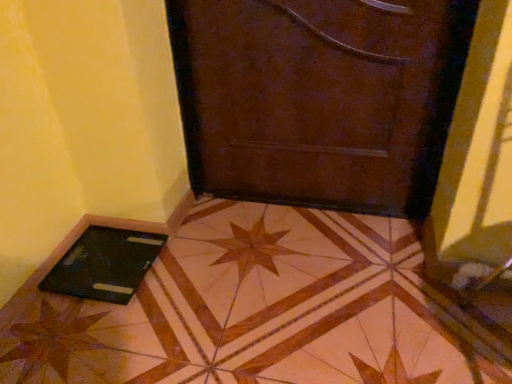
The width and height of the screenshot is (512, 384). What do you see at coordinates (261, 311) in the screenshot?
I see `black glossy laptop at lower left` at bounding box center [261, 311].

Locate an element on the screen. Image resolution: width=512 pixels, height=384 pixels. brown leather door at center is located at coordinates (317, 101).

Measure the distance between brown leather door at center and camera.

3.78 feet.

This screenshot has height=384, width=512. I want to click on black matte tablet at lower left, so click(x=104, y=264).

From the image's perspective, is brown leather door at center on black matte tablet at lower left?

Yes, from the image's perspective, brown leather door at center is above black matte tablet at lower left.

From a real-world perspective, is brown leather door at center above or below black matte tablet at lower left?

In terms of real-world spatial position, brown leather door at center is above black matte tablet at lower left.

Between brown leather door at center and black matte tablet at lower left, which one is positioned in front?

brown leather door at center.

Where is `door lying above the black matte tablet at lower left (from the image's perspective)`? The height and width of the screenshot is (384, 512). door lying above the black matte tablet at lower left (from the image's perspective) is located at coordinates (317, 101).

Can you tell me how much brown leather door at center and black glossy laptop at lower left differ in facing direction?

There is a 82.5-degree angle between the facing directions of brown leather door at center and black glossy laptop at lower left.

Locate an element on the screen. door above the black glossy laptop at lower left (from the image's perspective) is located at coordinates (317, 101).

Is brown leather door at center bigger or smaller than black glossy laptop at lower left?

In the image, brown leather door at center appears to be smaller than black glossy laptop at lower left.

From a real-world perspective, between black glossy laptop at lower left and black matte tablet at lower left, who is vertically higher?

black matte tablet at lower left is physically above.

Is black matte tablet at lower left surrounded by black glossy laptop at lower left?

Yes.

Between black glossy laptop at lower left and black matte tablet at lower left, which one has more height?

black glossy laptop at lower left is taller.

Is black glossy laptop at lower left to the left or to the right of black matte tablet at lower left in the image?

black glossy laptop at lower left is positioned on black matte tablet at lower left's right side.

Can you confirm if black glossy laptop at lower left is thinner than brown leather door at center?

In fact, black glossy laptop at lower left might be wider than brown leather door at center.

Does black glossy laptop at lower left lie in front of brown leather door at center?

Yes, the depth of black glossy laptop at lower left is less than that of brown leather door at center.

Is black glossy laptop at lower left turned away from brown leather door at center?

No, black glossy laptop at lower left is not facing away from brown leather door at center.

From a real-world perspective, is black glossy laptop at lower left beneath brown leather door at center?

Answer: Yes.

Would you consider black matte tablet at lower left to be distant from brown leather door at center?

That's not correct — black matte tablet at lower left is a little close to brown leather door at center.

Considering the positions of points (119, 277) and (354, 92), is point (119, 277) closer to camera compared to point (354, 92)?

No, (119, 277) is behind (354, 92).

Where is `door above the black matte tablet at lower left (from a real-world perspective)`? The height and width of the screenshot is (384, 512). door above the black matte tablet at lower left (from a real-world perspective) is located at coordinates (317, 101).

Is black matte tablet at lower left bigger or smaller than brown leather door at center?

Clearly, black matte tablet at lower left is smaller in size than brown leather door at center.

Where is `tablet computer above the black glossy laptop at lower left (from a real-world perspective)`? The height and width of the screenshot is (384, 512). tablet computer above the black glossy laptop at lower left (from a real-world perspective) is located at coordinates (104, 264).

Are black matte tablet at lower left and black glossy laptop at lower left making contact?

No, black matte tablet at lower left is not touching black glossy laptop at lower left.

Considering the relative sizes of black matte tablet at lower left and black glossy laptop at lower left in the image provided, is black matte tablet at lower left wider than black glossy laptop at lower left?

In fact, black matte tablet at lower left might be narrower than black glossy laptop at lower left.

Which is closer to the camera, (144, 257) or (191, 293)?

Point (144, 257) appears to be farther away from the viewer than point (191, 293).

This screenshot has width=512, height=384. I want to click on tablet computer that is below the brown leather door at center (from the image's perspective), so click(x=104, y=264).

Locate an element on the screen. This screenshot has width=512, height=384. door behind the black glossy laptop at lower left is located at coordinates (317, 101).

Based on their spatial positions, is brown leather door at center or black glossy laptop at lower left further from black matte tablet at lower left?

Among the two, brown leather door at center is located further to black matte tablet at lower left.

Estimate the real-world distances between objects in this image. Which object is closer to brown leather door at center, black matte tablet at lower left or black glossy laptop at lower left?

black glossy laptop at lower left is positioned closer to the anchor brown leather door at center.

Considering their positions, is black glossy laptop at lower left positioned further to brown leather door at center than black matte tablet at lower left?

Among the two, black matte tablet at lower left is located further to brown leather door at center.

When comparing their distances from black glossy laptop at lower left, does black matte tablet at lower left or brown leather door at center seem closer?

black matte tablet at lower left.

Considering their positions, is brown leather door at center positioned further to black glossy laptop at lower left than black matte tablet at lower left?

brown leather door at center.

From the image, which object appears to be farther from black matte tablet at lower left, black glossy laptop at lower left or brown leather door at center?

brown leather door at center.

Identify the location of tile between black matte tablet at lower left and brown leather door at center from left to right. (261, 311).